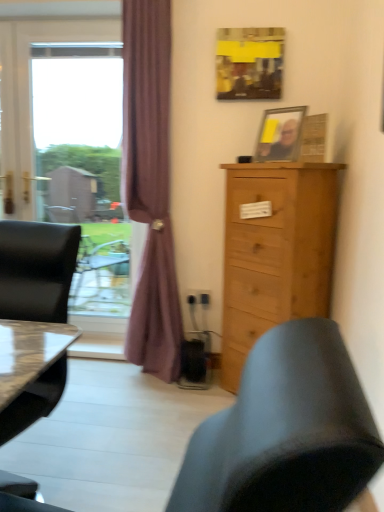
What is the approximate height of natural wood cabinet at right?

It is 1.25 meters.

What is the approximate width of transparent glass window at left?

transparent glass window at left is 4.80 inches in width.

Locate an element on the screen. Image resolution: width=384 pixels, height=512 pixels. natural wood cabinet at right is located at coordinates (275, 252).

From a real-world perspective, who is located higher, transparent glass window at left or matte black chair at left?

transparent glass window at left is physically above.

Can you confirm if transparent glass window at left is positioned to the right of matte black chair at left?

No, transparent glass window at left is not to the right of matte black chair at left.

Locate an element on the screen. This screenshot has width=384, height=512. window located above the matte black chair at left (from a real-world perspective) is located at coordinates (71, 152).

Considering the sizes of objects transparent glass window at left and matte black chair at left in the image provided, who is thinner, transparent glass window at left or matte black chair at left?

Thinner between the two is transparent glass window at left.

Locate an element on the screen. chest of drawers lying on the right of matte black chair at left is located at coordinates (275, 252).

How different are the orientations of natural wood cabinet at right and matte black chair at left in degrees?

There is a 29.8-degree angle between the facing directions of natural wood cabinet at right and matte black chair at left.

Based on the photo, is natural wood cabinet at right facing away from matte black chair at left?

No.

From a real-world perspective, is natural wood cabinet at right under matte black chair at left?

No, from a real-world perspective, natural wood cabinet at right is not under matte black chair at left.

Does natural wood cabinet at right have a larger size compared to purple fabric curtain at left?

Indeed, natural wood cabinet at right has a larger size compared to purple fabric curtain at left.

Image resolution: width=384 pixels, height=512 pixels. Identify the location of curtain behind the natural wood cabinet at right. (150, 187).

Between point (303, 202) and point (129, 18), which one is positioned behind?

The point (129, 18) is behind.

Is purple fabric curtain at left inside natural wood cabinet at right?

No, natural wood cabinet at right does not contain purple fabric curtain at left.

Considering the positions of objects transparent glass window at left and purple fabric curtain at left in the image provided, who is more to the right, transparent glass window at left or purple fabric curtain at left?

purple fabric curtain at left is more to the right.

You are a GUI agent. You are given a task and a screenshot of the screen. Output one action in this format:
    pyautogui.click(x=<x>, y=<y>)
    Task: Click on the curtain in front of the transparent glass window at left
    The height and width of the screenshot is (512, 384).
    Given the screenshot: What is the action you would take?
    pyautogui.click(x=150, y=187)

From the image's perspective, would you say transparent glass window at left is positioned over purple fabric curtain at left?

Yes, from the image's perspective, transparent glass window at left is over purple fabric curtain at left.

Considering the relative sizes of transparent glass window at left and purple fabric curtain at left in the image provided, is transparent glass window at left smaller than purple fabric curtain at left?

Indeed, transparent glass window at left has a smaller size compared to purple fabric curtain at left.

Considering the sizes of wooden picture frame at upper right, which ranks as the second picture frame in top-to-bottom order, and matte black chair at left in the image, is wooden picture frame at upper right, which ranks as the second picture frame in top-to-bottom order, bigger or smaller than matte black chair at left?

In the image, wooden picture frame at upper right, which ranks as the second picture frame in top-to-bottom order, appears to be smaller than matte black chair at left.

Can you confirm if wooden picture frame at upper right, which ranks as the second picture frame in top-to-bottom order, is positioned to the left of matte black chair at left?

No.

Which of these two, wooden picture frame at upper right, arranged as the 1th picture frame when ordered from the bottom, or matte black chair at left, stands shorter?

Standing shorter between the two is wooden picture frame at upper right, arranged as the 1th picture frame when ordered from the bottom.

Considering the sizes of objects matte black chair at left and natural wood cabinet at right in the image provided, who is bigger, matte black chair at left or natural wood cabinet at right?

Bigger between the two is natural wood cabinet at right.

Which object is thinner, matte black chair at left or natural wood cabinet at right?

natural wood cabinet at right is thinner.

Is matte black chair at left positioned with its back to natural wood cabinet at right?

matte black chair at left does not have its back to natural wood cabinet at right.

Does matte black chair at left have a lesser width compared to yellow paper at upper center, the 2th picture frame positioned from the bottom?

No.

Is matte black chair at left not inside yellow paper at upper center, the 2th picture frame positioned from the bottom?

Yes.

Which is more to the right, matte black chair at left or yellow paper at upper center, the 2th picture frame positioned from the bottom?

yellow paper at upper center, the 2th picture frame positioned from the bottom.

Is matte black chair at left taller or shorter than yellow paper at upper center, acting as the first picture frame starting from the top?

Considering their sizes, matte black chair at left has more height than yellow paper at upper center, acting as the first picture frame starting from the top.

This screenshot has width=384, height=512. In order to click on chair that is under the transparent glass window at left (from a real-world perspective) in this screenshot , I will do `click(36, 270)`.

Find the location of a particular element. This screenshot has width=384, height=512. chest of drawers above the matte black chair at left (from the image's perspective) is located at coordinates (275, 252).

Considering their positions, is transparent glass window at left positioned further to purple fabric curtain at left than wooden picture frame at upper right, which ranks as the second picture frame in top-to-bottom order?

wooden picture frame at upper right, which ranks as the second picture frame in top-to-bottom order, lies further to purple fabric curtain at left than the other object.

Looking at the image, which one is located closer to matte black chair at left, natural wood cabinet at right or yellow paper at upper center, the 2th picture frame positioned from the bottom?

Among the two, natural wood cabinet at right is located nearer to matte black chair at left.

Considering their positions, is matte black chair at left positioned further to natural wood cabinet at right than transparent glass window at left?

matte black chair at left lies further to natural wood cabinet at right than the other object.

Considering their positions, is matte black chair at left positioned further to yellow paper at upper center, the 2th picture frame positioned from the bottom, than purple fabric curtain at left?

Among the two, matte black chair at left is located further to yellow paper at upper center, the 2th picture frame positioned from the bottom.

From the image, which object appears to be farther from wooden picture frame at upper right, arranged as the 1th picture frame when ordered from the bottom, natural wood cabinet at right or transparent glass window at left?

transparent glass window at left is further to wooden picture frame at upper right, arranged as the 1th picture frame when ordered from the bottom.

Based on their spatial positions, is yellow paper at upper center, acting as the first picture frame starting from the top, or purple fabric curtain at left further from transparent glass window at left?

Based on the image, yellow paper at upper center, acting as the first picture frame starting from the top, appears to be further to transparent glass window at left.

Estimate the real-world distances between objects in this image. Which object is further from matte black chair at left, transparent glass window at left or purple fabric curtain at left?

transparent glass window at left lies further to matte black chair at left than the other object.

Considering their positions, is matte black chair at left positioned further to yellow paper at upper center, the 2th picture frame positioned from the bottom, than wooden picture frame at upper right, which ranks as the second picture frame in top-to-bottom order?

Based on the image, matte black chair at left appears to be further to yellow paper at upper center, the 2th picture frame positioned from the bottom.

Image resolution: width=384 pixels, height=512 pixels. In order to click on curtain between yellow paper at upper center, the 2th picture frame positioned from the bottom, and natural wood cabinet at right, in the vertical direction in this screenshot , I will do `click(150, 187)`.

Identify the location of the chest of drawers located between matte black chair at left and wooden picture frame at upper right, which ranks as the second picture frame in top-to-bottom order, in the left-right direction. (275, 252).

At what (x,y) coordinates should I click in order to perform the action: click on picture frame between matte black chair at left and purple fabric curtain at left from front to back. Please return your answer as a coordinate pair (x, y). The height and width of the screenshot is (512, 384). Looking at the image, I should click on (279, 134).

The height and width of the screenshot is (512, 384). In order to click on curtain between matte black chair at left and transparent glass window at left along the z-axis in this screenshot , I will do `click(150, 187)`.